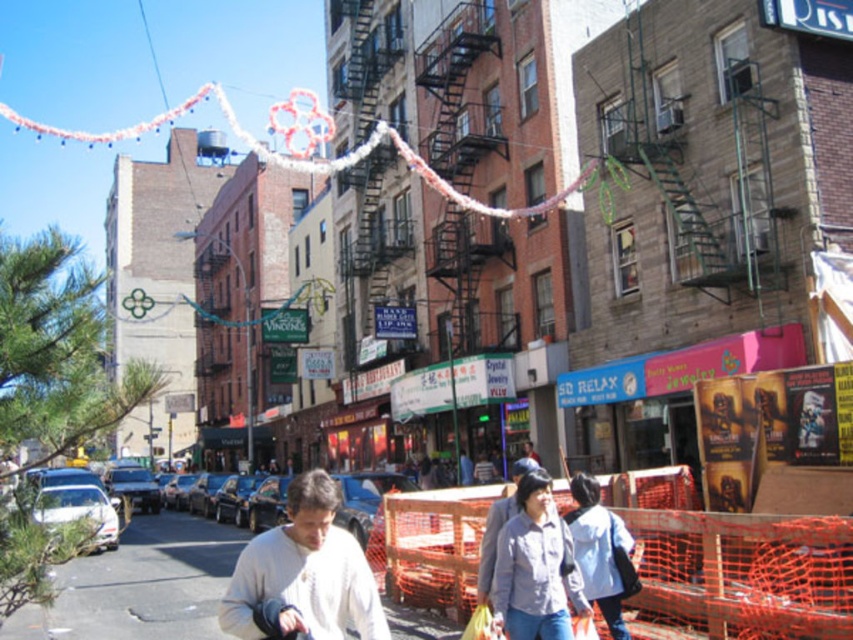
You are standing at the origin point of the coordinate system in this urban street scene. You want to find the white matte sweater at center. According to the coordinate system, where is the white matte sweater located?

The white matte sweater at center is located at the coordinate point of [305,572].

You are a tailor observing a crowd in the urban street scene. You notice a person wearing a white matte sweater at center and another wearing a white matte jacket at lower right. Which clothing item has a greater width?

The white matte sweater at center has a greater width than the white matte jacket at lower right according to the description.

You are a photographer standing at the camera position. You want to take a closeup shot of the white matte sweater at center. Can you estimate how far you need to move forward to get a clear closeup shot?

The white matte sweater at center is 25.52 meters from camera. To get a clear closeup shot, you would need to move forward to reduce the distance between the camera and the sweater, but the exact distance adjustment depends on the camera lens and desired framing.